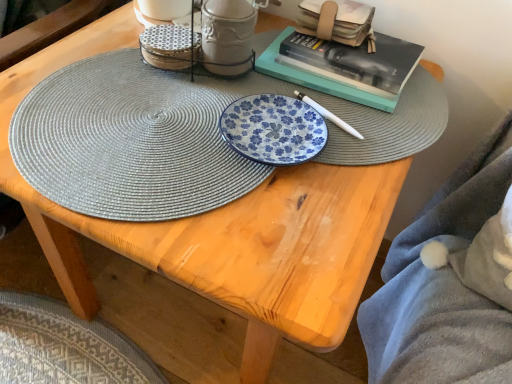
Find the location of `vacant area that is in front of porcelain textured coasters at upper center, arranged as the first tableware when viewed from the left`. vacant area that is in front of porcelain textured coasters at upper center, arranged as the first tableware when viewed from the left is located at coordinates (139, 121).